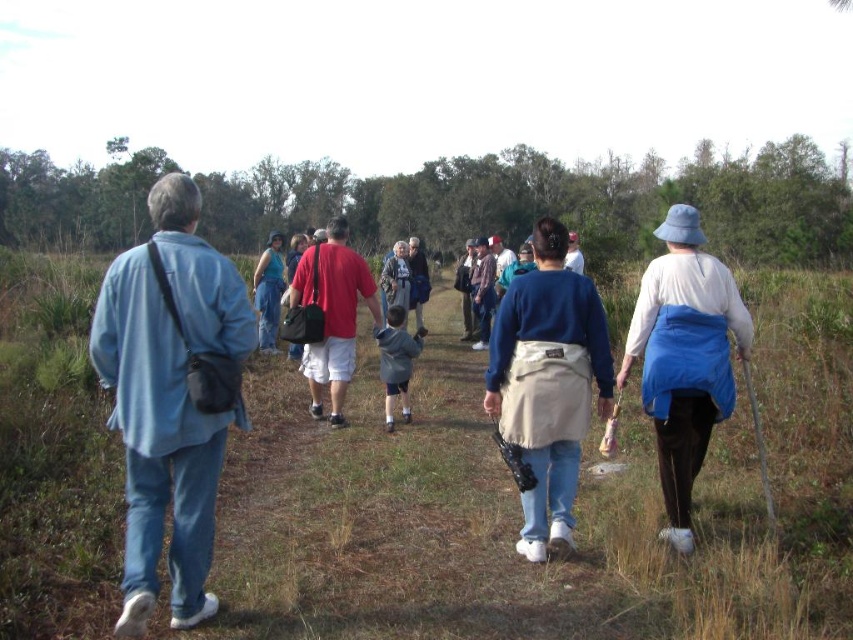
Is blue fabric jacket at center in front of matte red shirt at center?

Yes, blue fabric jacket at center is closer to the viewer.

Is blue fabric jacket at center smaller than matte red shirt at center?

Yes, blue fabric jacket at center is smaller than matte red shirt at center.

Is point (537, 445) in front of point (334, 392)?

Yes.

Where is `blue fabric jacket at center`? blue fabric jacket at center is located at coordinates (548, 381).

Which is in front, point (120, 413) or point (302, 284)?

Point (120, 413) is more forward.

Which is behind, point (231, 416) or point (341, 252)?

Point (341, 252)

Locate an element on the screen. blue denim pants at left is located at coordinates (167, 400).

Which is above, blue denim pants at left or white cotton shirt at center-right?

white cotton shirt at center-right is higher up.

Is blue denim pants at left positioned at the back of white cotton shirt at center-right?

No, blue denim pants at left is in front of white cotton shirt at center-right.

Looking at this image, who is more distant from viewer, (x=132, y=483) or (x=635, y=353)?

The point (x=635, y=353) is behind.

Where is `blue denim pants at left`? This screenshot has height=640, width=853. blue denim pants at left is located at coordinates (167, 400).